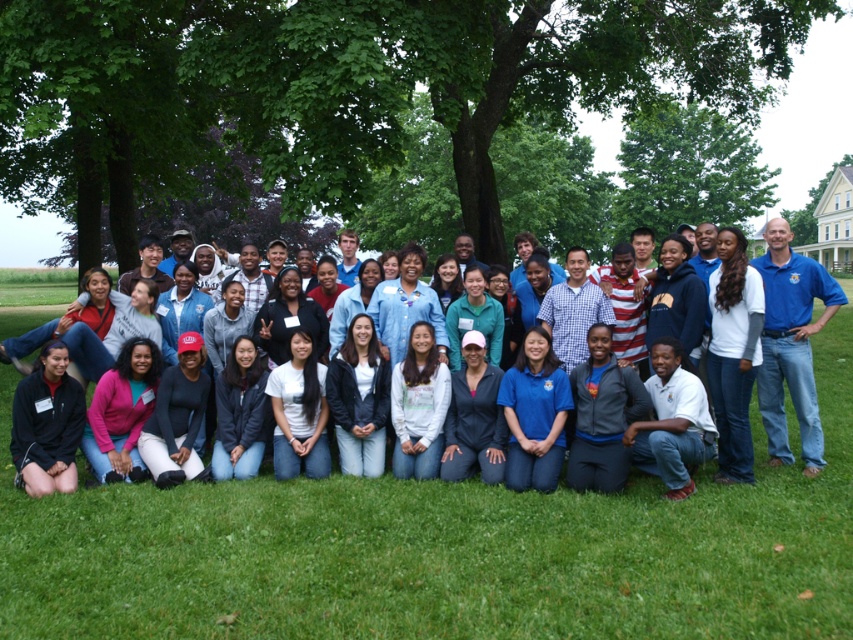
Consider the image. You are standing in the middle of the grassy area and want to move towards the blue shirt at right. Which direction should you walk to avoid the green leafy tree at center?

To reach the blue shirt at right while avoiding the green leafy tree at center, walk to the right side of the green leafy tree at center since it is positioned to the left of the blue shirt at right.

You are planning to set up a picnic blanket for a group of 10 people. The blanket requires 100 square feet of space. Considering the distance between the green grass at center and the green leafy tree at upper center, is the area between them sufficient for the blanket?

The green grass at center is 134.44 feet away from the green leafy tree at upper center. Since the distance between them is greater than the required 100 square feet, the area between them is sufficient for the picnic blanket.